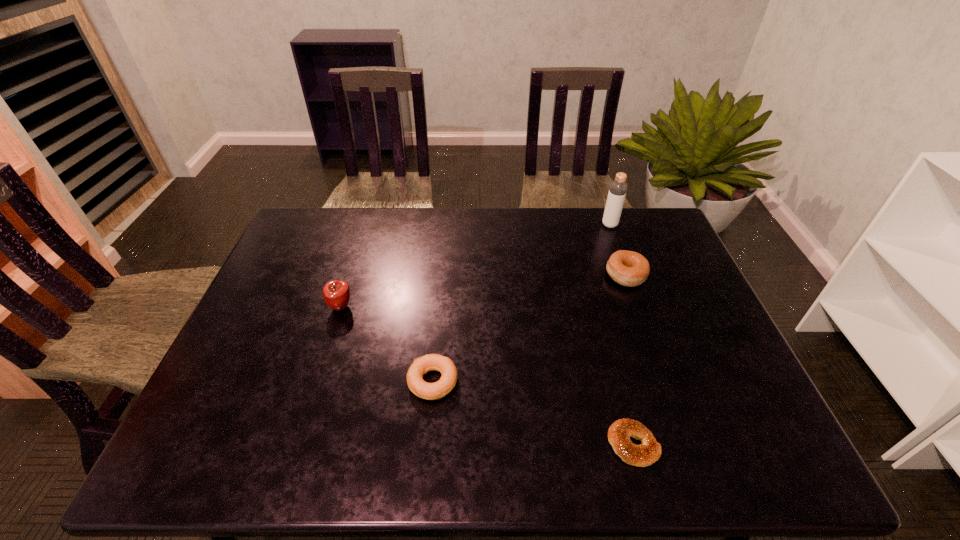
I want to click on the tallest object, so click(617, 192).

You are a GUI agent. You are given a task and a screenshot of the screen. Output one action in this format:
    pyautogui.click(x=<x>, y=<y>)
    Task: Click on the bottle
    
    Given the screenshot: What is the action you would take?
    pyautogui.click(x=617, y=192)

Identify the location of the second tallest object. The height and width of the screenshot is (540, 960). (336, 293).

You are a GUI agent. You are given a task and a screenshot of the screen. Output one action in this format:
    pyautogui.click(x=<x>, y=<y>)
    Task: Click on the third nearest object
    The width and height of the screenshot is (960, 540).
    Given the screenshot: What is the action you would take?
    pyautogui.click(x=336, y=293)

Locate an element on the screen. The image size is (960, 540). the third tallest object is located at coordinates (628, 268).

The image size is (960, 540). In order to click on the farthest bagel in this screenshot , I will do `click(628, 268)`.

You are a GUI agent. You are given a task and a screenshot of the screen. Output one action in this format:
    pyautogui.click(x=<x>, y=<y>)
    Task: Click on the leftmost bagel
    This screenshot has height=540, width=960.
    Given the screenshot: What is the action you would take?
    pyautogui.click(x=431, y=362)

Image resolution: width=960 pixels, height=540 pixels. I want to click on the second tallest bagel, so click(431, 362).

Where is `the nearest bagel`? This screenshot has width=960, height=540. the nearest bagel is located at coordinates (619, 433).

Identify the location of the shortest bagel. The height and width of the screenshot is (540, 960). (619, 433).